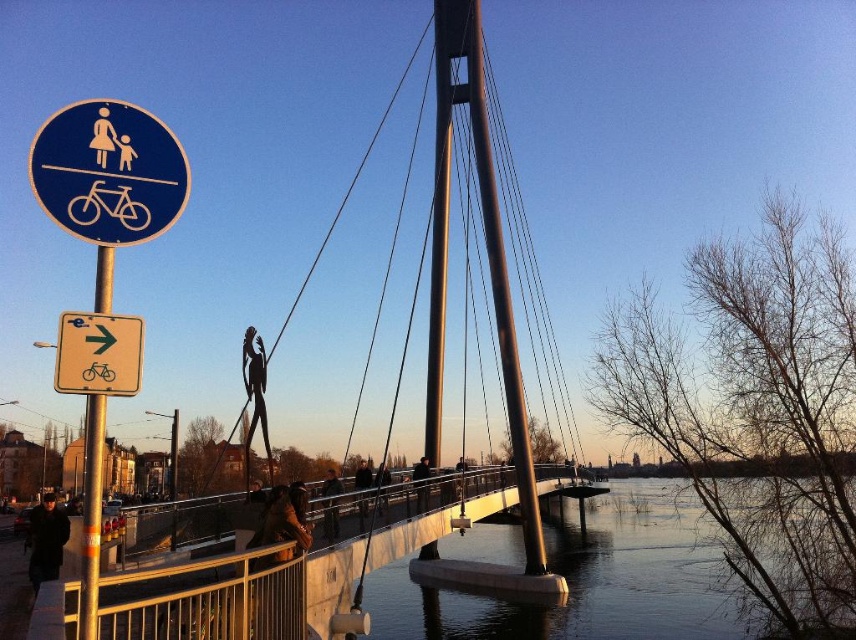
Looking at this image, which of these two, metallic gray bridge at center or blue metallic sign at upper left, stands taller?

metallic gray bridge at center

Who is more distant from viewer, (262, 634) or (150, 113)?

The point (150, 113) is behind.

Find the location of a particular element. This screenshot has height=640, width=856. metallic gray bridge at center is located at coordinates (278, 577).

Does point (68, 598) come farther from viewer compared to point (27, 540)?

No, (68, 598) is closer to viewer.

Is metallic gray bridge at center bigger than dark brown leather coat at lower left?

Yes.

Is point (360, 556) farther from camera compared to point (58, 522)?

That is True.

In order to click on metallic gray bridge at center in this screenshot , I will do `click(278, 577)`.

Measure the distance from metallic gray bridge at center to dark brown leather jacket at center.

The distance of metallic gray bridge at center from dark brown leather jacket at center is 7.03 meters.

Does point (40, 600) come farther from viewer compared to point (420, 500)?

No, it is in front of (420, 500).

Between point (250, 570) and point (415, 472), which one is positioned in front?

Point (250, 570) is in front.

The height and width of the screenshot is (640, 856). Identify the location of metallic gray bridge at center. (278, 577).